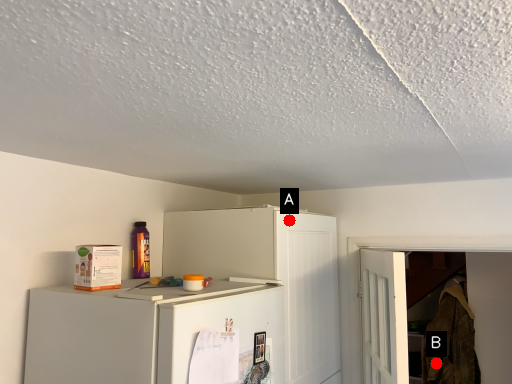
Question: Two points are circled on the image, labeled by A and B beside each circle. Which point is further to the camera?

Choices:
 (A) A is further
 (B) B is further

Answer: (B)